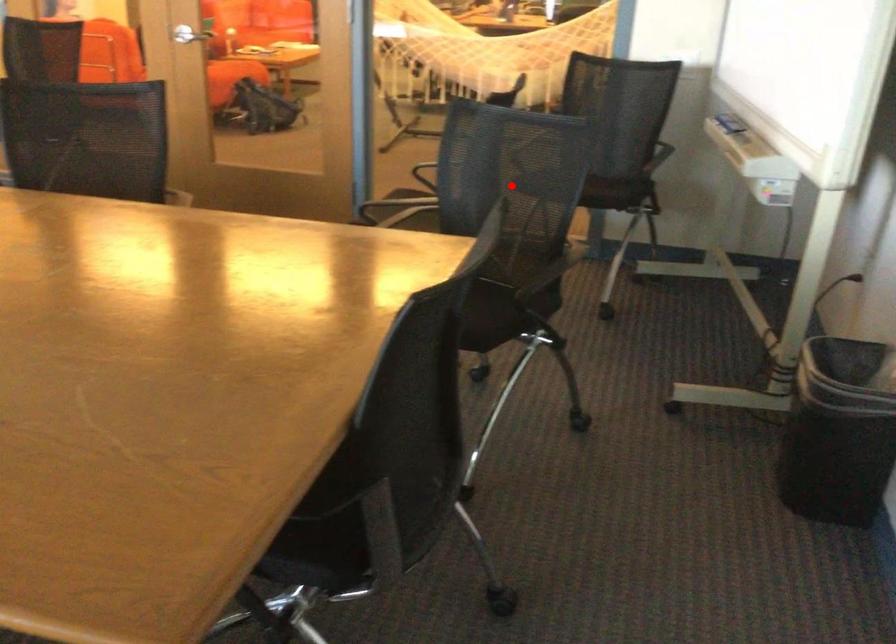
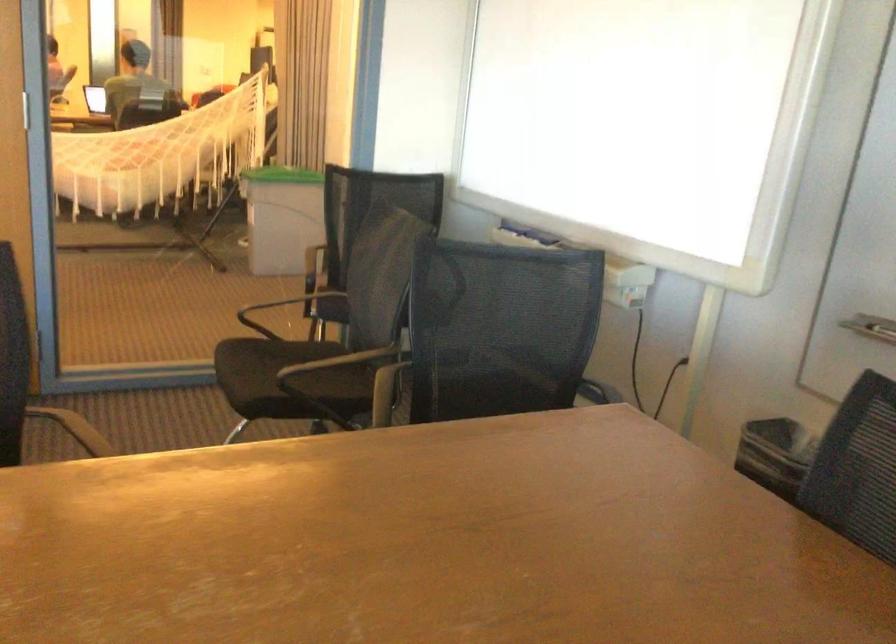
Locate, in the second image, the point that corresponds to the highlighted location in the first image.

(501, 328)